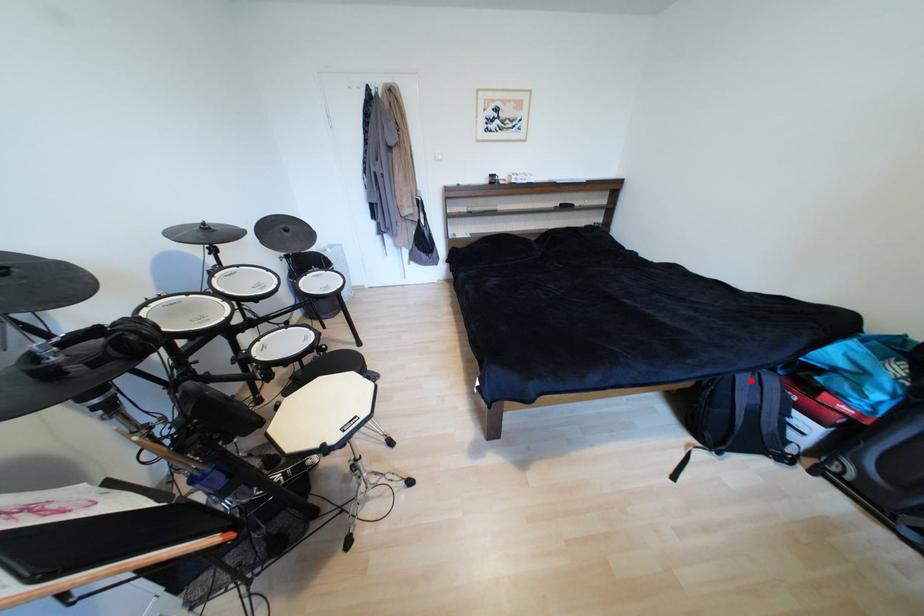
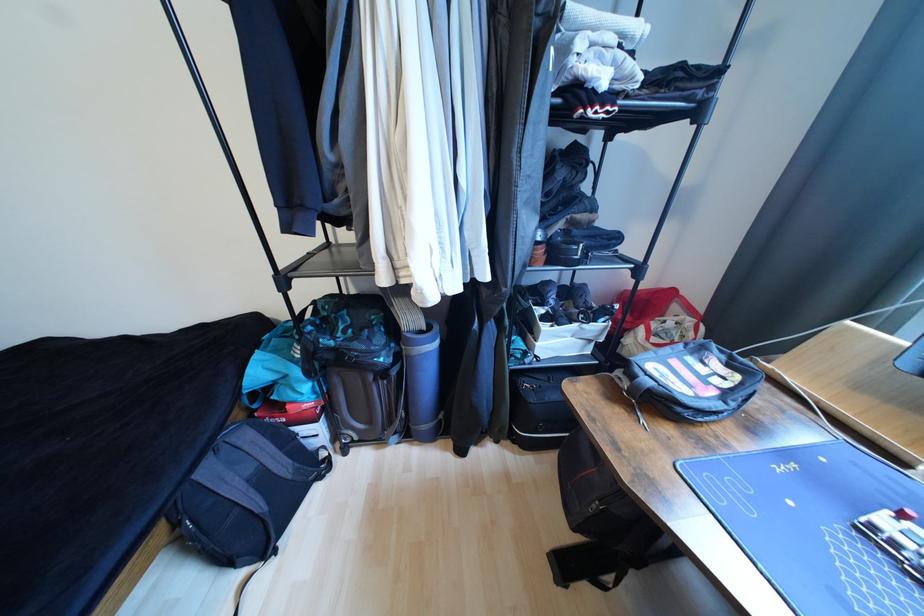
Find the pixel in the second image that matches the highlighted location in the first image.

(215, 472)